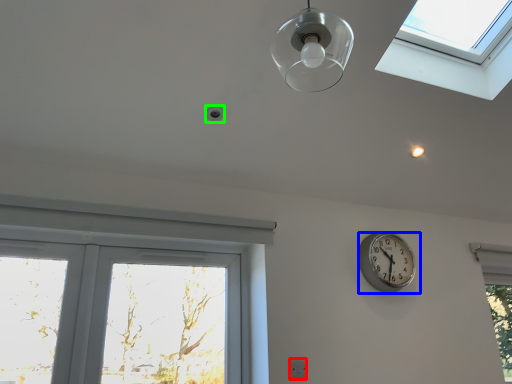
Question: Which is nearer to the electric outlet (highlighted by a red box)? wall clock (highlighted by a blue box) or droplight (highlighted by a green box).

Choices:
 (A) wall clock
 (B) droplight

Answer: (A)